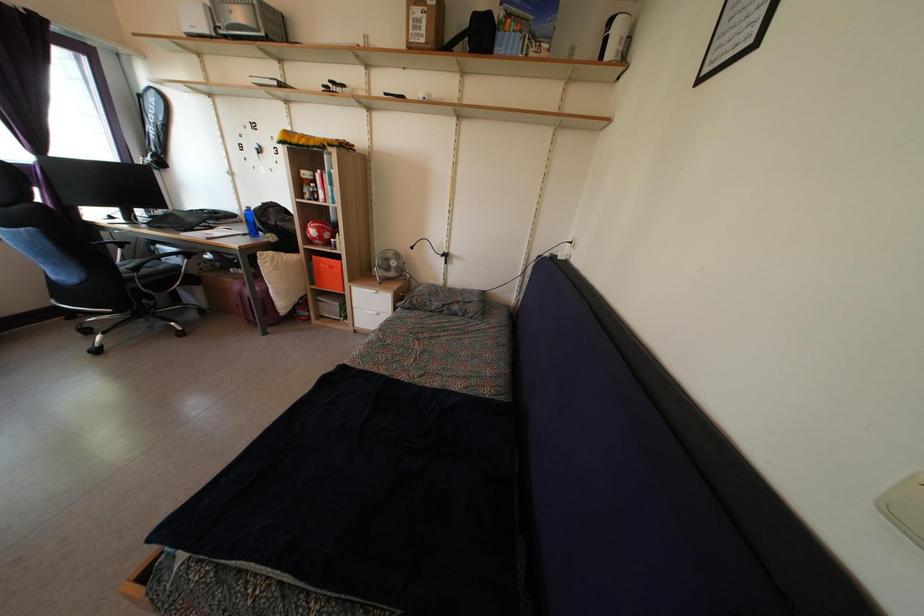
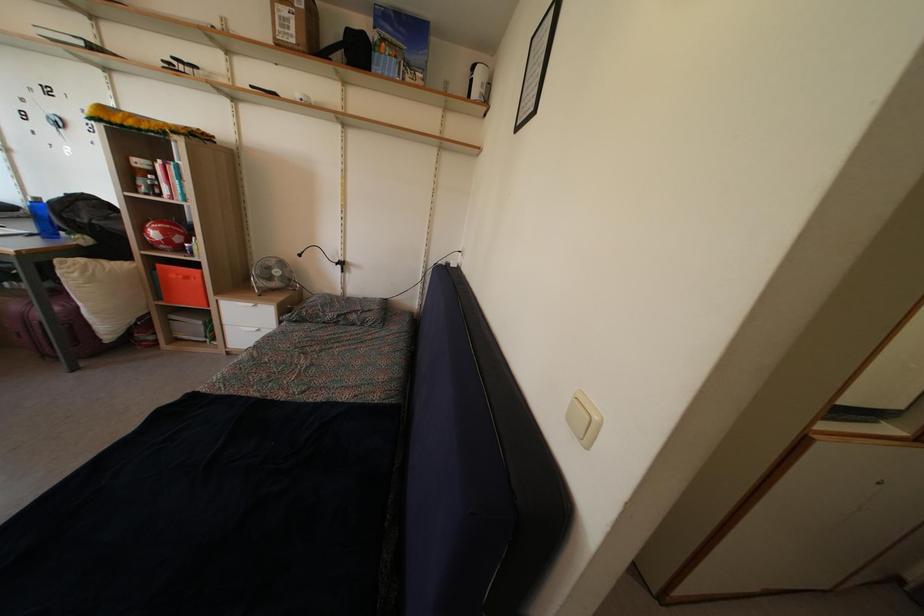
Find the pixel in the second image that matches (358,318) in the first image.

(228, 336)